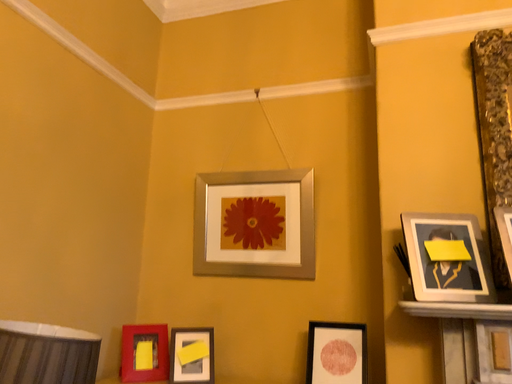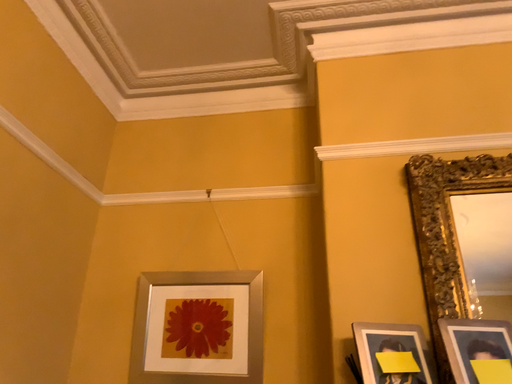
Question: Which way did the camera rotate in the video?

Choices:
 (A) rotated downward
 (B) rotated upward

Answer: (B)